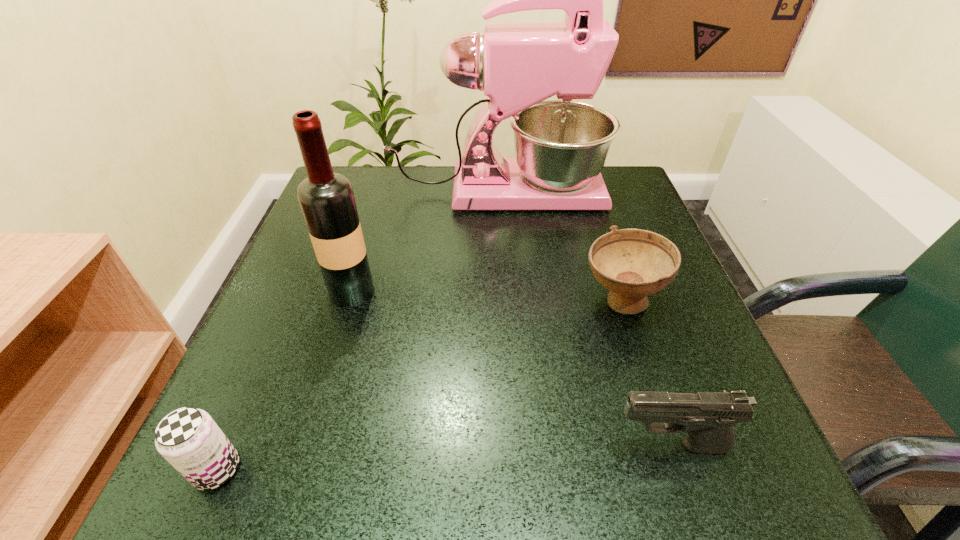
I want to click on soup bowl present at the right edge, so (632, 263).

Find the location of a particular element. Image resolution: width=960 pixels, height=540 pixels. pistol that is positioned at the right edge is located at coordinates (708, 417).

Locate an element on the screen. This screenshot has width=960, height=540. object that is at the far left corner is located at coordinates (561, 146).

Where is `object that is at the near left corner`? Image resolution: width=960 pixels, height=540 pixels. object that is at the near left corner is located at coordinates (189, 439).

You are a GUI agent. You are given a task and a screenshot of the screen. Output one action in this format:
    pyautogui.click(x=<x>, y=<y>)
    Task: Click on the object that is positioned at the far right corner
    
    Given the screenshot: What is the action you would take?
    pyautogui.click(x=561, y=146)

Locate an element on the screen. The width and height of the screenshot is (960, 540). object positioned at the near right corner is located at coordinates 708,417.

Locate an element on the screen. The width and height of the screenshot is (960, 540). free space at the far edge of the desktop is located at coordinates (450, 191).

In the image, there is a desktop. Where is `vacant space at the near edge`? The height and width of the screenshot is (540, 960). vacant space at the near edge is located at coordinates (572, 502).

Find the location of a particular element. The width and height of the screenshot is (960, 540). vacant space at the left edge of the desktop is located at coordinates (308, 326).

At what (x,y) coordinates should I click in order to perform the action: click on vacant space at the right edge of the desktop. Please return your answer as a coordinate pair (x, y). This screenshot has height=540, width=960. Looking at the image, I should click on (656, 313).